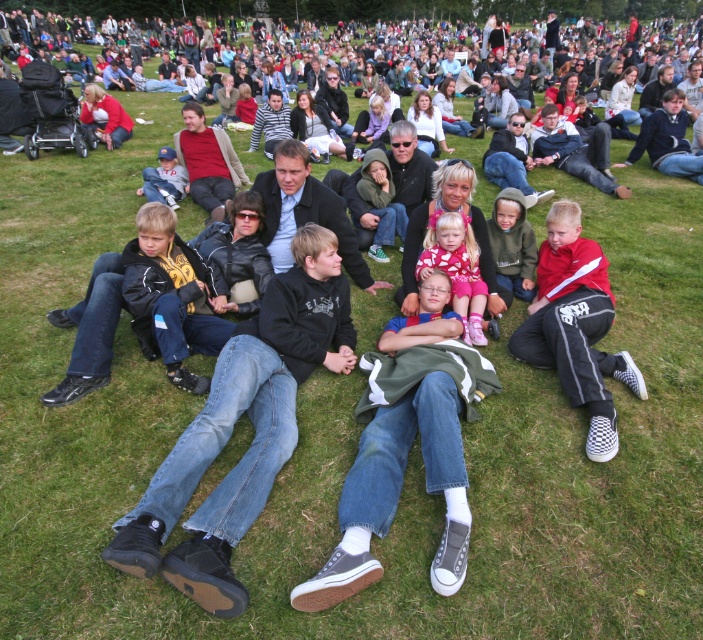
Between point (420, 268) and point (439, 289), which one is positioned behind?

Positioned behind is point (420, 268).

Based on the photo, does pink satin dress at center have a smaller size compared to blue denim jeans at center?

No.

Who is more distant from viewer, (458,275) or (434,269)?

The point (458,275) is more distant.

This screenshot has height=640, width=703. I want to click on pink satin dress at center, so 456,269.

Is blue denim jeans at center to the right of matte blue cap at center from the viewer's perspective?

Yes, blue denim jeans at center is to the right of matte blue cap at center.

The width and height of the screenshot is (703, 640). What do you see at coordinates (423, 317) in the screenshot?
I see `blue denim jeans at center` at bounding box center [423, 317].

The height and width of the screenshot is (640, 703). Identify the location of blue denim jeans at center. (423, 317).

Does point (465, 330) lie behind point (172, 160)?

No, (465, 330) is in front of (172, 160).

Is pink satin dress at center to the left of matte blue cap at center from the viewer's perspective?

No, pink satin dress at center is not to the left of matte blue cap at center.

Who is more distant from viewer, [423,241] or [174,172]?

Positioned behind is point [174,172].

This screenshot has width=703, height=640. I want to click on pink satin dress at center, so click(456, 269).